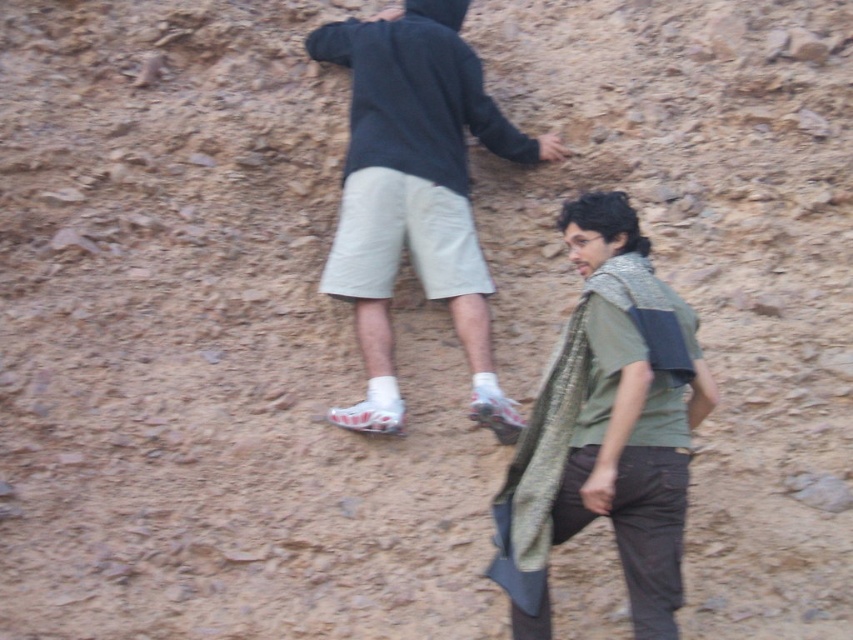
Question: Is green textured shirt at center wider than dark gray hoodie at upper center?

Choices:
 (A) no
 (B) yes

Answer: (A)

Question: Which of the following is the closest to the observer?

Choices:
 (A) (447, 192)
 (B) (666, 496)

Answer: (B)

Question: Among these objects, which one is farthest from the camera?

Choices:
 (A) dark gray hoodie at upper center
 (B) green textured shirt at center

Answer: (A)

Question: Considering the relative positions of green textured shirt at center and dark gray hoodie at upper center in the image provided, where is green textured shirt at center located with respect to dark gray hoodie at upper center?

Choices:
 (A) below
 (B) above

Answer: (A)

Question: In this image, where is green textured shirt at center located relative to dark gray hoodie at upper center?

Choices:
 (A) right
 (B) left

Answer: (A)